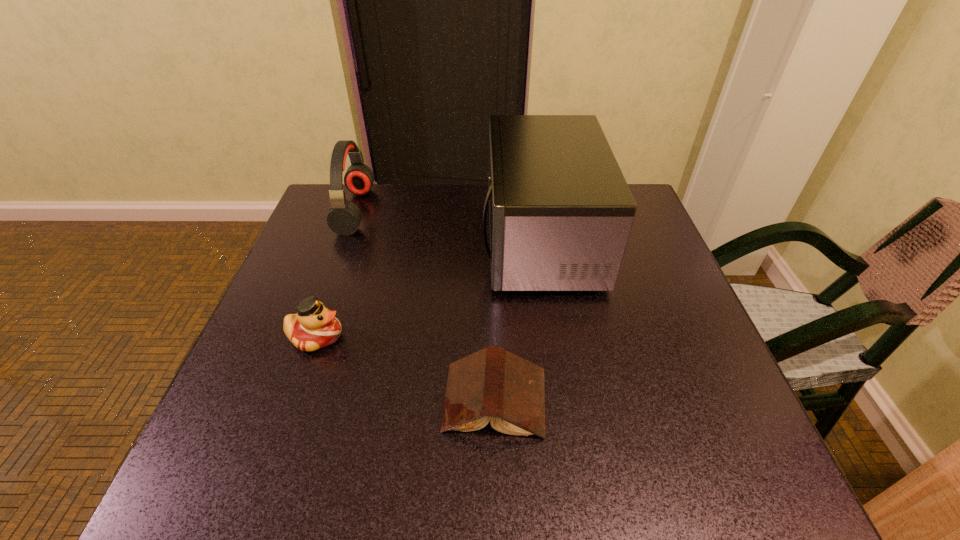
I want to click on free region located 0.300m on the face of the duck, so click(492, 336).

You are a GUI agent. You are given a task and a screenshot of the screen. Output one action in this format:
    pyautogui.click(x=<x>, y=<y>)
    Task: Click on the free space located on the back of the nearest object
    The image size is (960, 540).
    Given the screenshot: What is the action you would take?
    pyautogui.click(x=492, y=270)

Where is `microwave oven that is at the far edge`? microwave oven that is at the far edge is located at coordinates 560,210.

In order to click on earphone that is at the far edge in this screenshot , I will do `click(344, 217)`.

Find the location of `object at the near edge`. object at the near edge is located at coordinates (492, 384).

Locate an element on the screen. The image size is (960, 540). earphone at the left edge is located at coordinates (344, 217).

Identify the location of duck that is at the left edge. (314, 326).

The width and height of the screenshot is (960, 540). Find the location of `object located in the right edge section of the desktop`. object located in the right edge section of the desktop is located at coordinates (560, 210).

At what (x,y) coordinates should I click in order to perform the action: click on object at the far left corner. Please return your answer as a coordinate pair (x, y). Image resolution: width=960 pixels, height=540 pixels. Looking at the image, I should click on (344, 217).

Find the location of `object at the far right corner`. object at the far right corner is located at coordinates (560, 210).